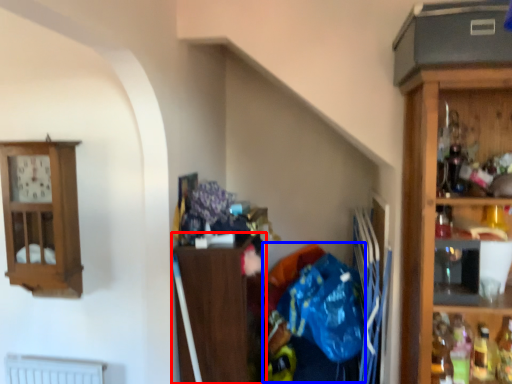
Question: Among these objects, which one is nearest to the camera, cabinetry (highlighted by a red box) or waste (highlighted by a blue box)?

Choices:
 (A) cabinetry
 (B) waste

Answer: (B)